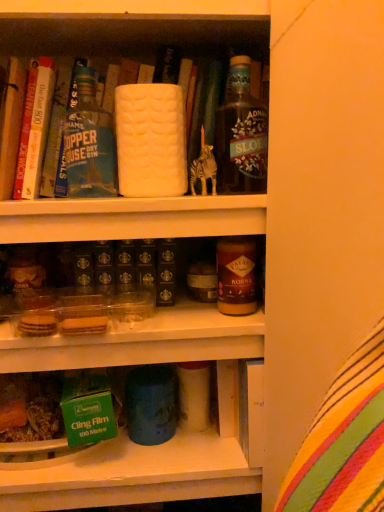
Question: Is brown glass jar at center not inside translucent glass bottle at upper right, the 1th bottle from the right?

Choices:
 (A) yes
 (B) no

Answer: (A)

Question: Does brown glass jar at center appear on the left side of translucent glass bottle at upper right, positioned as the 2th bottle in left-to-right order?

Choices:
 (A) yes
 (B) no

Answer: (A)

Question: Is brown glass jar at center oriented towards translucent glass bottle at upper right, positioned as the 2th bottle in left-to-right order?

Choices:
 (A) no
 (B) yes

Answer: (A)

Question: Is brown glass jar at center closer to the viewer compared to translucent glass bottle at upper right, the 1th bottle from the right?

Choices:
 (A) yes
 (B) no

Answer: (B)

Question: Does brown glass jar at center touch translucent glass bottle at upper right, the 1th bottle from the right?

Choices:
 (A) yes
 (B) no

Answer: (B)

Question: Considering the relative positions of brown glass jar at center and translucent glass bottle at upper right, positioned as the 2th bottle in left-to-right order, in the image provided, is brown glass jar at center to the right of translucent glass bottle at upper right, positioned as the 2th bottle in left-to-right order, from the viewer's perspective?

Choices:
 (A) yes
 (B) no

Answer: (B)

Question: From the image's perspective, is white matte bottle at upper center, which is counted as the first bottle, starting from the left, beneath hardcover book at upper left, which ranks as the 2th book in back-to-front order?

Choices:
 (A) no
 (B) yes

Answer: (A)

Question: Is white matte bottle at upper center, positioned as the second bottle in right-to-left order, at the left side of hardcover book at upper left, which ranks as the 2th book in back-to-front order?

Choices:
 (A) no
 (B) yes

Answer: (A)

Question: Is the position of white matte bottle at upper center, positioned as the second bottle in right-to-left order, more distant than that of hardcover book at upper left, the 1th book positioned from the front?

Choices:
 (A) no
 (B) yes

Answer: (B)

Question: Is white matte bottle at upper center, which is counted as the first bottle, starting from the left, far from hardcover book at upper left, which ranks as the 2th book in back-to-front order?

Choices:
 (A) yes
 (B) no

Answer: (B)

Question: Considering the relative sizes of white matte bottle at upper center, positioned as the second bottle in right-to-left order, and hardcover book at upper left, the 1th book positioned from the front, in the image provided, is white matte bottle at upper center, positioned as the second bottle in right-to-left order, bigger than hardcover book at upper left, the 1th book positioned from the front,?

Choices:
 (A) yes
 (B) no

Answer: (A)

Question: Is white matte bottle at upper center, which is counted as the first bottle, starting from the left, facing towards hardcover book at upper left, the 1th book positioned from the front?

Choices:
 (A) no
 (B) yes

Answer: (A)

Question: Considering the relative sizes of hardcover book at upper left, which ranks as the 2th book in back-to-front order, and translucent glass bottle at upper right, positioned as the 2th bottle in left-to-right order, in the image provided, is hardcover book at upper left, which ranks as the 2th book in back-to-front order, shorter than translucent glass bottle at upper right, positioned as the 2th bottle in left-to-right order,?

Choices:
 (A) no
 (B) yes

Answer: (A)